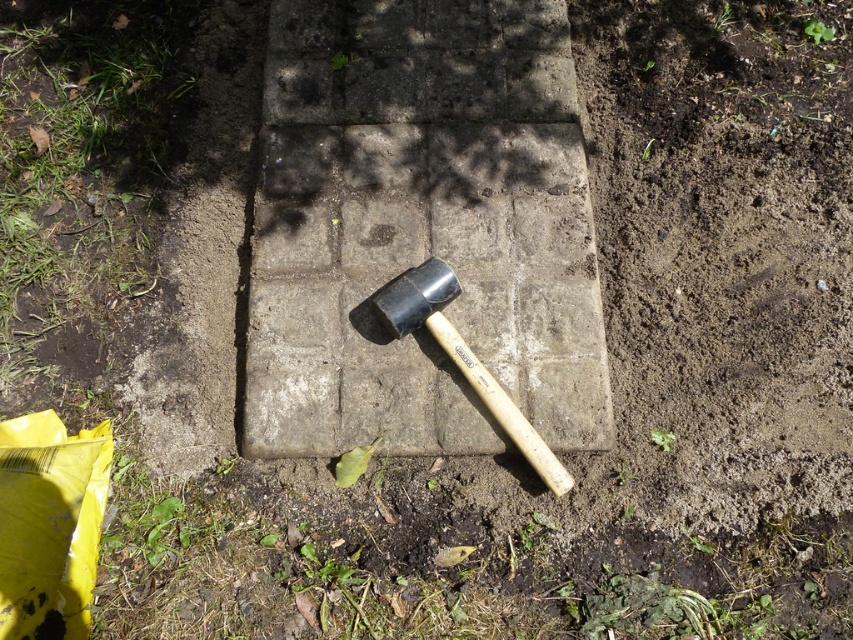
You are a construction worker standing in front of the concrete block and want to reach both the hammer and the soil. Which point, point (x=312, y=173) or point (x=431, y=308), is closer to you?

Point (x=312, y=173) is closer to you because it is further to the viewer than point (x=431, y=308).

You are a drone operator trying to map the construction site. You need to locate the green grass at lower left. What are its coordinates?

The green grass at lower left is located at coordinates point (80,172).